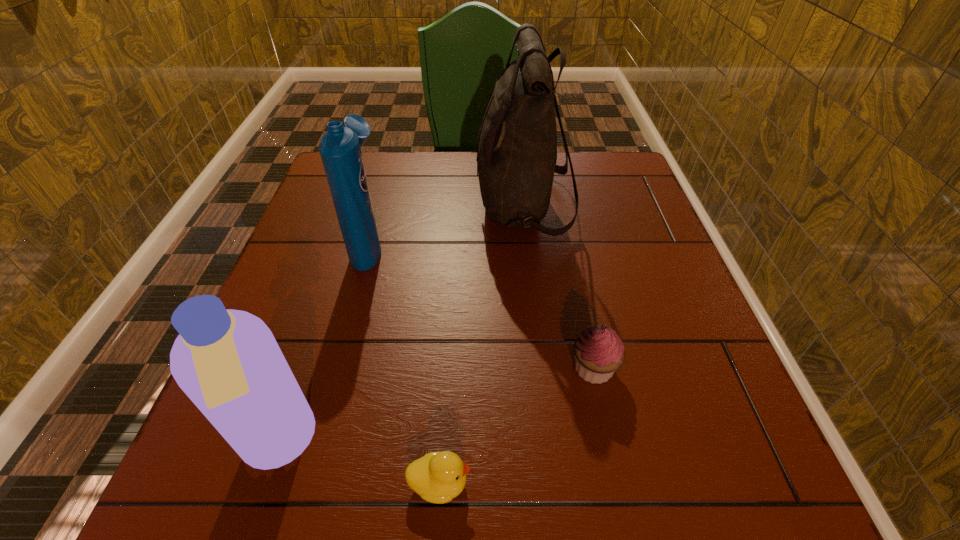
You are a GUI agent. You are given a task and a screenshot of the screen. Output one action in this format:
    pyautogui.click(x=<x>, y=<y>)
    Task: Click on the vacant space at the near left corner of the desktop
    
    Given the screenshot: What is the action you would take?
    pyautogui.click(x=235, y=491)

In the image, there is a desktop. At what (x,y) coordinates should I click in order to perform the action: click on vacant space at the far right corner. Please return your answer as a coordinate pair (x, y). The image size is (960, 540). Looking at the image, I should click on pyautogui.click(x=614, y=190).

Where is `free space between the shortest object and the tallest object`? free space between the shortest object and the tallest object is located at coordinates (481, 345).

Where is `free point between the third object from right to left and the farther shampoo`? This screenshot has width=960, height=540. free point between the third object from right to left and the farther shampoo is located at coordinates (404, 364).

Identify the location of free spot between the duckling and the fourth tallest object. (516, 426).

Locate an element on the screen. free space that is in between the backpack and the farther shampoo is located at coordinates (446, 226).

This screenshot has height=540, width=960. I want to click on vacant space that's between the cupcake and the nearer shampoo, so click(x=436, y=406).

Where is `unoccupied area between the farther shampoo and the duckling`? Image resolution: width=960 pixels, height=540 pixels. unoccupied area between the farther shampoo and the duckling is located at coordinates (404, 364).

Find the location of a particular element. The image size is (960, 540). vacant region between the farther shampoo and the third object from left to right is located at coordinates (x=404, y=364).

Where is `empty space that is in between the third object from right to left and the fourth tallest object`? The width and height of the screenshot is (960, 540). empty space that is in between the third object from right to left and the fourth tallest object is located at coordinates (516, 426).